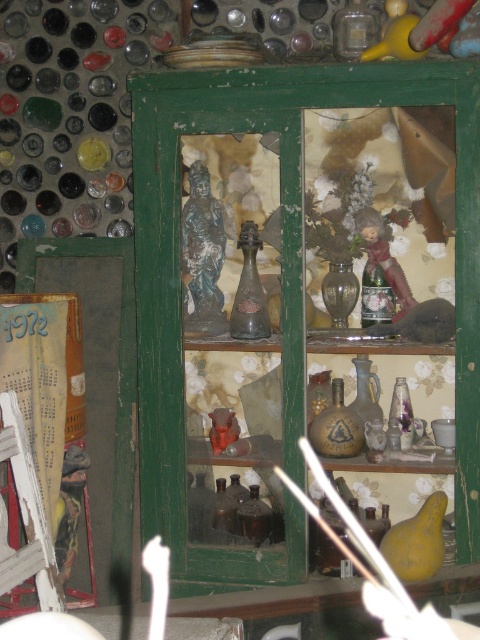
You are standing in front of the vintage green wooden cabinet and want to reach two points inside it. The first point is at coordinate point(260, 291) and the second is at point(389, 234). Which point is closer to you?

Point(260, 291) is in front of point(389, 234), so it is closer to you.

You are an interior designer assessing the placement of items in a room. You need to ensure that the green matte cabinet at center and the matte brown bottle at center are arranged in a way that maintains visual balance. Given their sizes, which object should be placed higher to achieve this balance?

The green matte cabinet at center is taller than the matte brown bottle at center, so placing the taller green matte cabinet at center on a lower shelf and the shorter matte brown bottle at center on a higher shelf would help maintain visual balance by counterbalancing their heights.